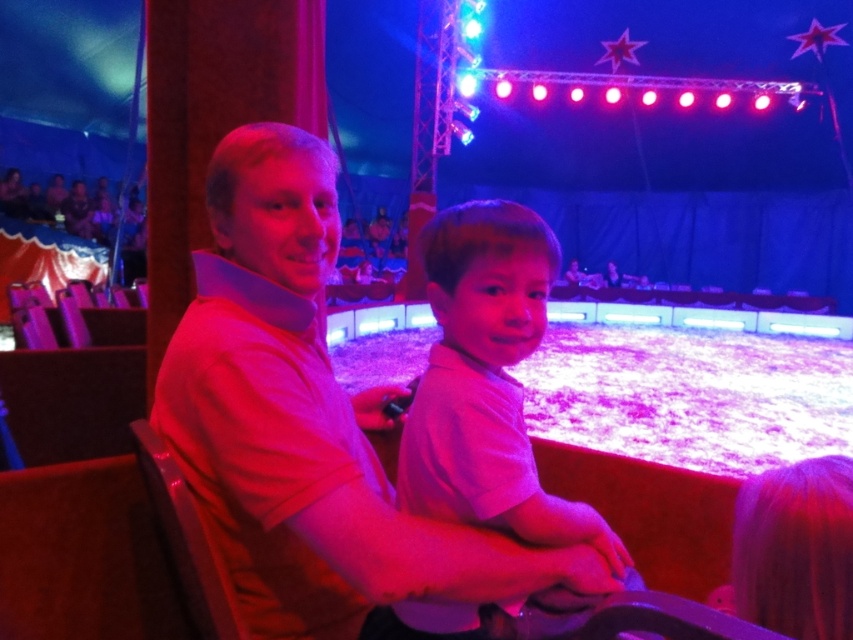
You are a parent at the circus tent and want to sit next to your child on the wooden bench. The point where you are currently sitting is at coordinate point(334,483). Can you determine if there is enough space between you and your child to comfortably sit together?

The distance between the parent and the child at point(334,483) is 86.80 centimeters, which is sufficient for comfortable seating as the typical space needed for two people sitting together is around 70 centimeters.

You are a photographer trying to capture the father and son sitting on the wooden bench in the circus tent. You notice a bright light from the stage lights. To avoid overexposure, you want to position your camera so that the light does not directly hit the subjects. Based on the coordinates provided, where should you position your camera relative to the point at point (x=306, y=424) to ensure the light source is not directly in front of the subjects?

The point (x=306, y=424) is on the matte pink shirt at center. To avoid direct light from the stage lights hitting the subjects, position the camera to the side or behind the subjects relative to the light source, ensuring the light is not directly in front of the point on the matte pink shirt at center.

You are standing at the back of the circus tent and want to walk towards the two spectators. Which point, point (380,576) or point (415,401), is closer to you?

Point (415,401) is closer to you because it is behind point (380,576). Since point (380,576) is in front of point (415,401), the latter is farther away from your current position at the back of the tent.